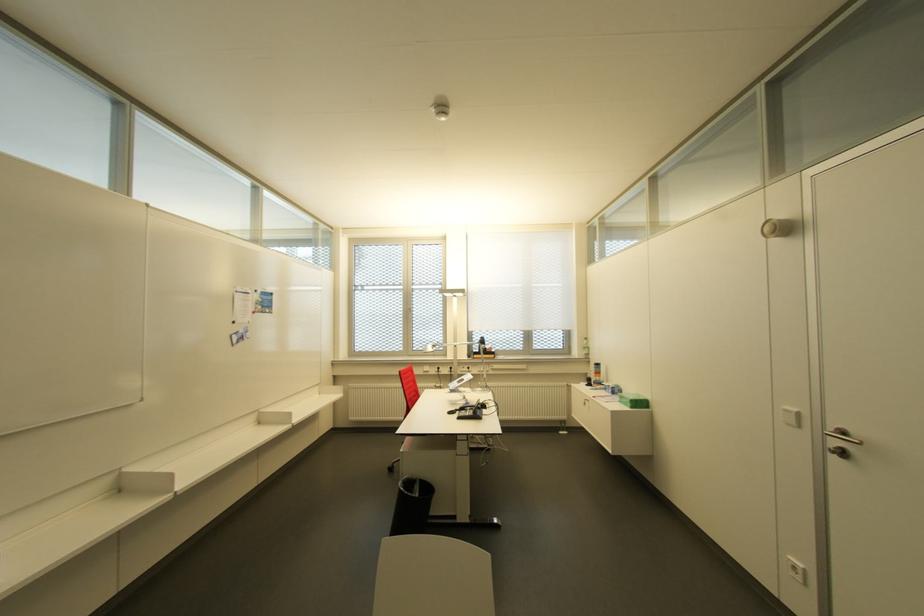
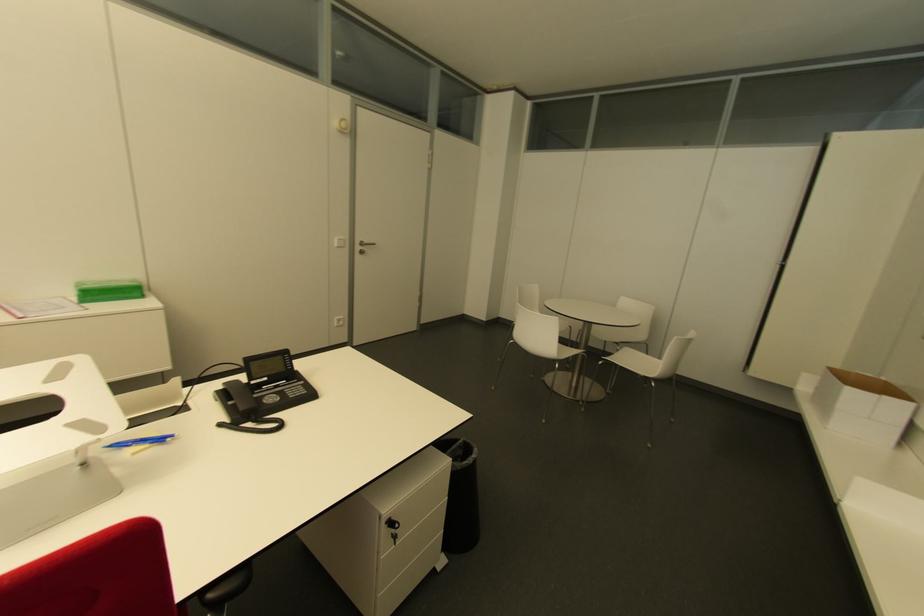
Where in the second image is the point corresponding to the point at 796,415 from the first image?

(343, 240)